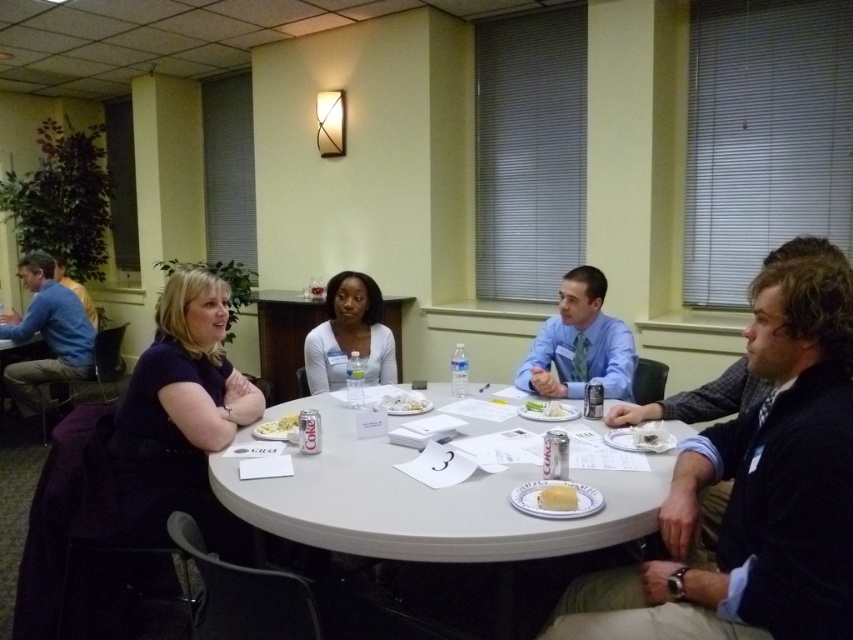
Question: Is white paper napkin at center above white matte cake at center?

Choices:
 (A) yes
 (B) no

Answer: (A)

Question: Which of the following is the closest to the observer?

Choices:
 (A) white matte cake at center
 (B) white paper napkin at center
 (C) white paper plate at center
 (D) yellow cake at lower center

Answer: (D)

Question: Is smooth white shirt at center closer to camera compared to white paper napkin at center?

Choices:
 (A) yes
 (B) no

Answer: (B)

Question: Which of the following is the farthest from the observer?

Choices:
 (A) (399, 413)
 (B) (364, 276)
 (C) (329, 444)

Answer: (B)

Question: Considering the real-world distances, which object is farthest from the smooth white shirt at center?

Choices:
 (A) white matte cake at center
 (B) dark blue fabric shirt at left
 (C) white paper plate at center

Answer: (A)

Question: Can you confirm if white plastic table at center is positioned below white paper napkin at center?

Choices:
 (A) yes
 (B) no

Answer: (A)